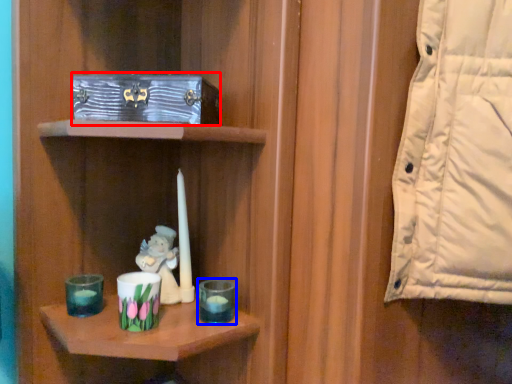
Question: Which object appears closest to the camera in this image, box (highlighted by a red box) or candle holder (highlighted by a blue box)?

Choices:
 (A) box
 (B) candle holder

Answer: (A)